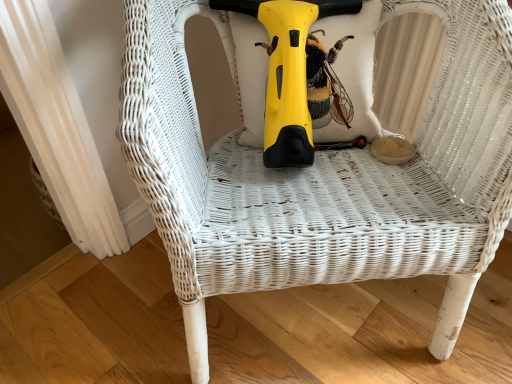
The width and height of the screenshot is (512, 384). What do you see at coordinates (326, 82) in the screenshot?
I see `yellow plastic bee at center` at bounding box center [326, 82].

The height and width of the screenshot is (384, 512). Find the location of `yellow plastic bee at center`. yellow plastic bee at center is located at coordinates (326, 82).

Measure the distance between point (307, 67) and camera.

Point (307, 67) is 30.04 inches from camera.

What is the approximate width of yellow plastic bee at center?

The width of yellow plastic bee at center is 9.84 inches.

Locate an element on the screen. This screenshot has height=384, width=512. yellow plastic bee at center is located at coordinates (326, 82).